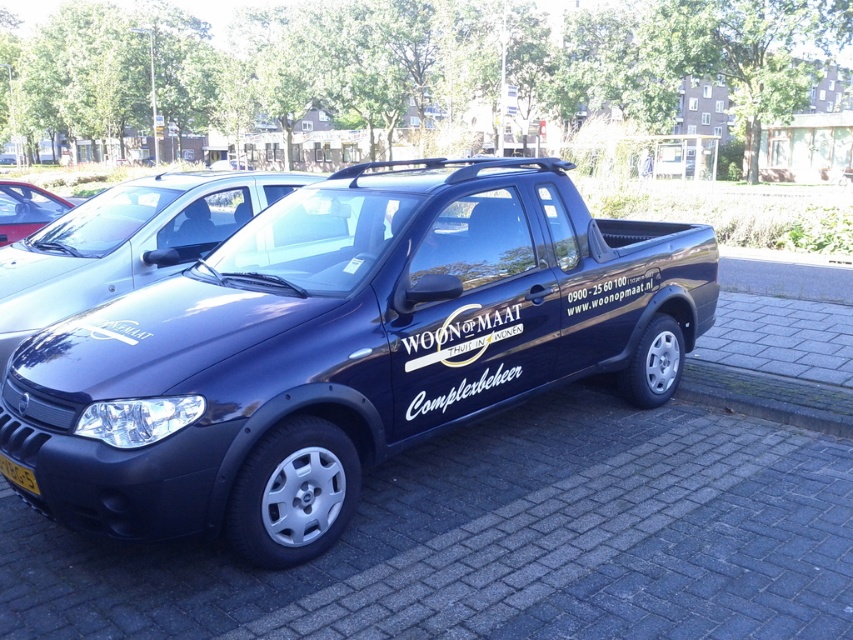
You are standing in a parking lot and see the glossy dark blue pickup truck at center. If you want to reach into the truck bed to grab a tool, will you be able to do so without moving closer?

The glossy dark blue pickup truck at center is 2.74 meters away from the viewer. Since this distance is too far to comfortably reach into the truck bed without moving closer, you will need to step forward to access it.

You are standing at the camera position and want to walk directly to the point at coordinates point (x=21, y=230). How far will you have to walk?

The point at coordinates point (x=21, y=230) is 8.03 meters away from the camera, so you will have to walk 8.03 meters to reach it.

You are a delivery driver who needs to park your vehicle in a spot that requires the license plate to be visible from the front. Given the positioning of the matte black pickup truck at center and the yellow plastic license plate at lower left, will the license plate be visible when parked in this spot?

The matte black pickup truck at center is positioned to the left of the yellow plastic license plate at lower left, so the license plate is likely visible from the front as it is placed to the right side of the truck.